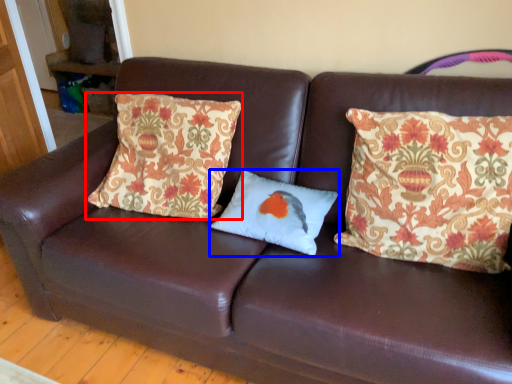
Question: Which of the following is the farthest to the observer, pillow (highlighted by a red box) or pillow (highlighted by a blue box)?

Choices:
 (A) pillow
 (B) pillow

Answer: (B)